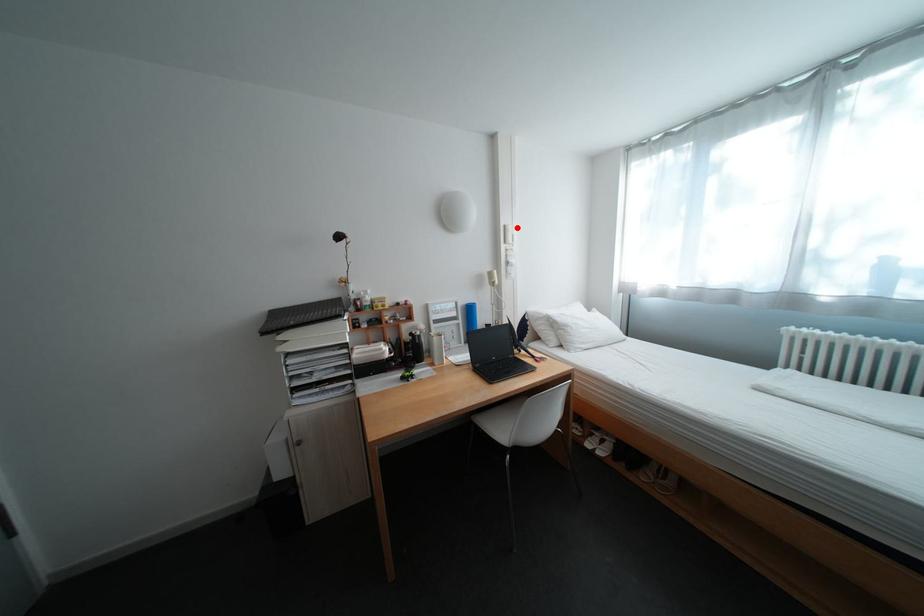
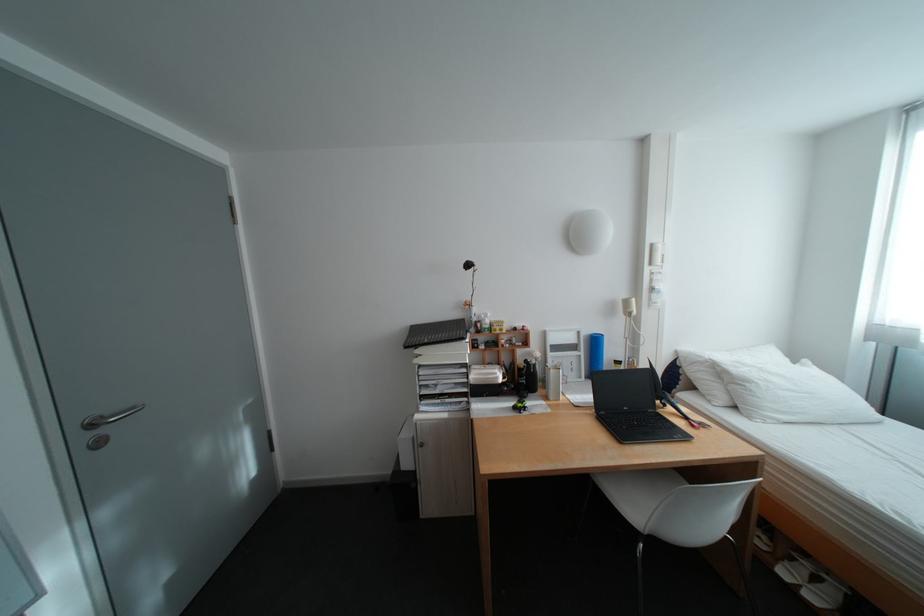
Question: A red point is marked in image1. In image2, is the corresponding 3D point closer to the camera or farther? Reply with the corresponding letter.

Choices:
 (A) The corresponding 3D point is closer.
 (B) The corresponding 3D point is farther.

Answer: (B)